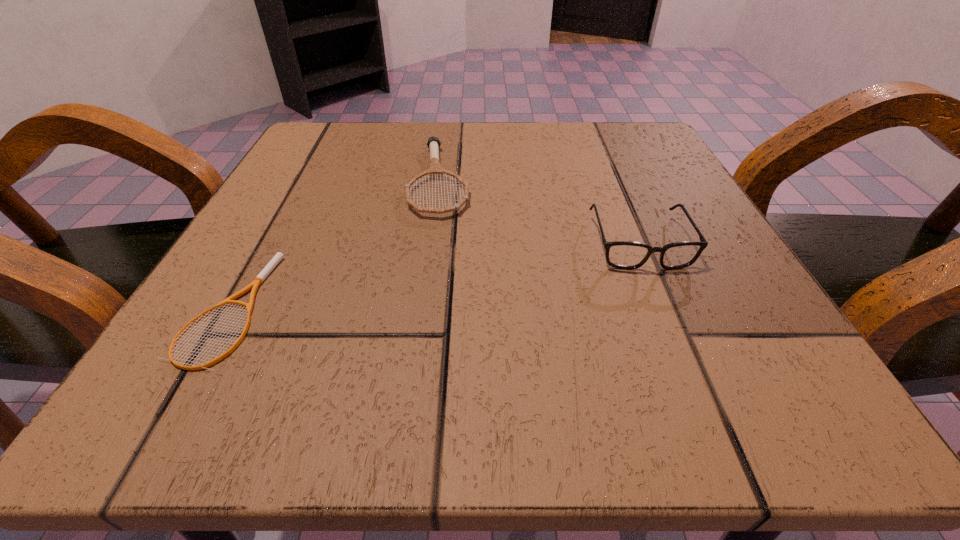
Identify which object is the nearest to the rightmost object. Please provide its 2D coordinates. Your answer should be formatted as a tuple, i.e. [(x, y)], where the tuple contains the x and y coordinates of a point satisfying the conditions above.

[(435, 169)]

Select which object is the closest to the farther tennis racket. Please provide its 2D coordinates. Your answer should be formatted as a tuple, i.e. [(x, y)], where the tuple contains the x and y coordinates of a point satisfying the conditions above.

[(258, 280)]

At what (x,y) coordinates should I click in order to perform the action: click on free location that satisfies the following two spatial constraints: 1. on the back side of the left tennis racket; 2. on the right side of the farther tennis racket. Please return your answer as a coordinate pair (x, y). Image resolution: width=960 pixels, height=540 pixels. Looking at the image, I should click on (300, 180).